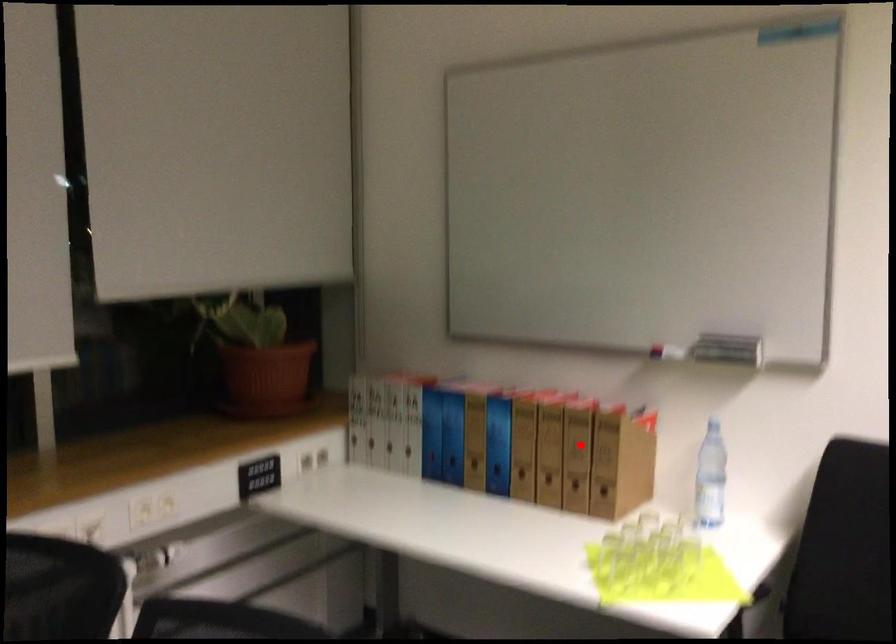
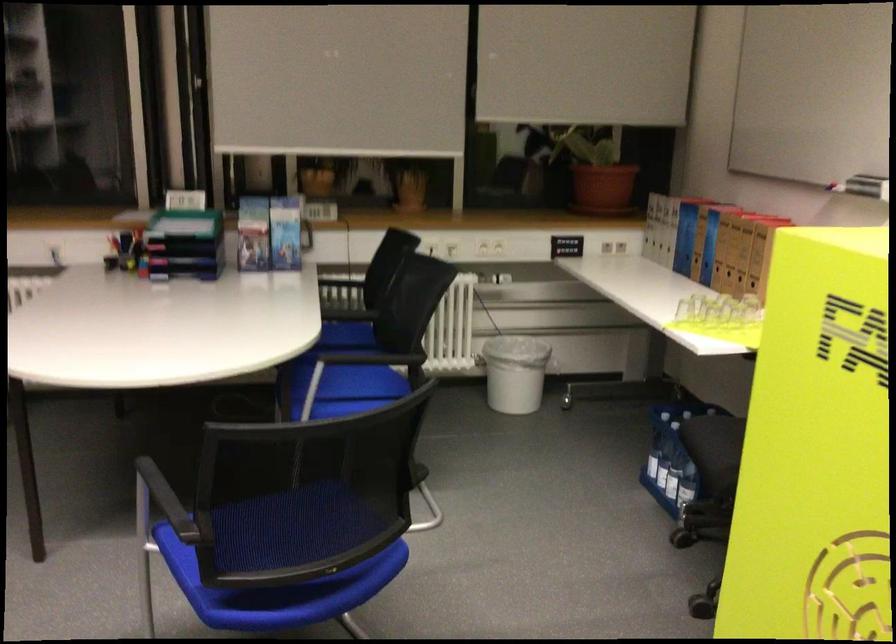
Question: I am providing you with two images of the same scene from different viewpoints. Image1 has a red point marked. In image2, the corresponding 3D location appears at what relative position? Reply with the corresponding letter.

Choices:
 (A) Closer
 (B) Farther

Answer: (B)